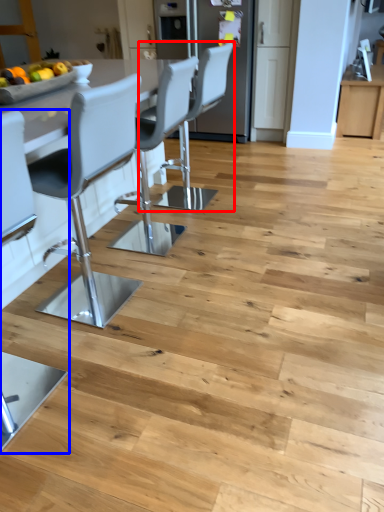
Question: Among these objects, which one is nearest to the camera, chair (highlighted by a red box) or chair (highlighted by a blue box)?

Choices:
 (A) chair
 (B) chair

Answer: (B)